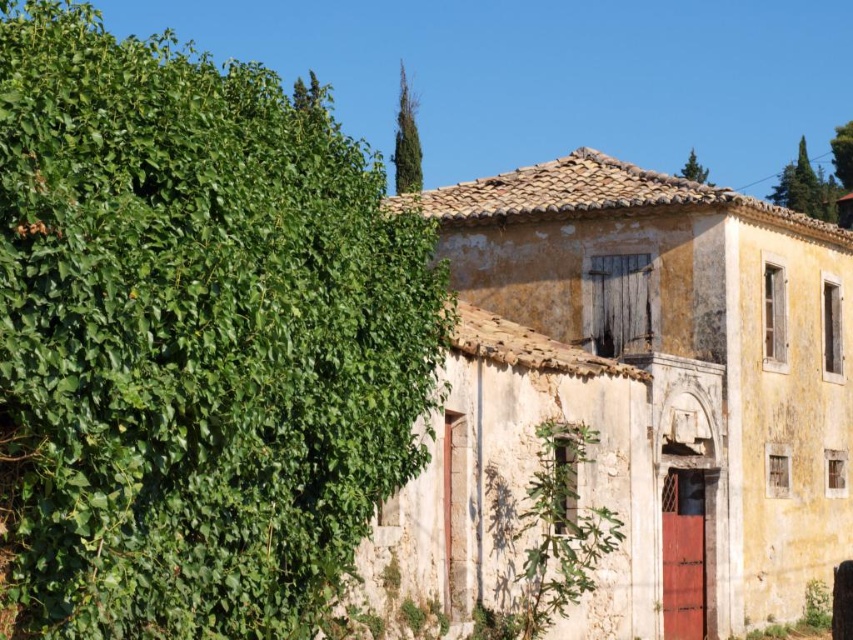
You are standing in front of the yellowish plaster building at center and want to walk to the green leafy hedge at left. Which direction should you face to move towards it?

You should face to the left to move towards the green leafy hedge at left since it is located to the left of the yellowish plaster building at center.

You are standing in front of the yellowish plaster building at center and want to trim the green leafy hedge at left. Which direction should you move to reach the hedge?

The green leafy hedge at left is located above the yellowish plaster building at center, so you should move upwards to reach it.